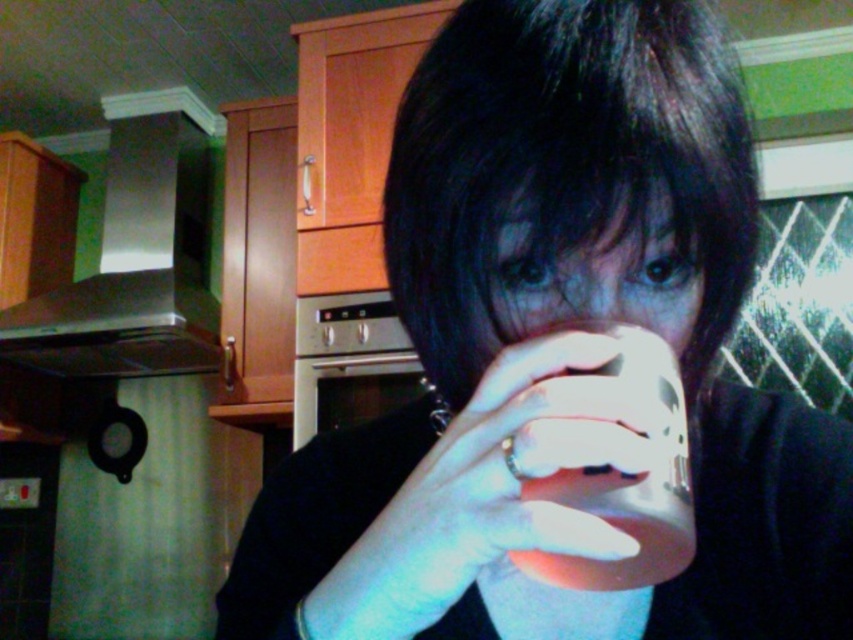
Locate an element on the screen. satin silver exhaust hood at upper left is located at coordinates (136, 257).

Is point (35, 308) closer to camera compared to point (498, 232)?

No, (35, 308) is further to viewer.

Does point (144, 253) come in front of point (521, 216)?

No, it is behind (521, 216).

Find the location of a particular element. satin silver exhaust hood at upper left is located at coordinates (136, 257).

Which of these two, white matte cup at center or matte white cup at center, stands taller?

Standing taller between the two is white matte cup at center.

The width and height of the screenshot is (853, 640). What are the coordinates of `white matte cup at center` in the screenshot? It's located at (486, 492).

You are a GUI agent. You are given a task and a screenshot of the screen. Output one action in this format:
    pyautogui.click(x=<x>, y=<y>)
    Task: Click on the white matte cup at center
    
    Given the screenshot: What is the action you would take?
    pyautogui.click(x=486, y=492)

Can you confirm if white matte cup at center is wider than satin silver exhaust hood at upper left?

No, white matte cup at center is not wider than satin silver exhaust hood at upper left.

What do you see at coordinates (486, 492) in the screenshot?
I see `white matte cup at center` at bounding box center [486, 492].

Does point (466, 422) come closer to viewer compared to point (143, 131)?

Yes, it is.

At what (x,y) coordinates should I click in order to perform the action: click on white matte cup at center. Please return your answer as a coordinate pair (x, y). Looking at the image, I should click on (486, 492).